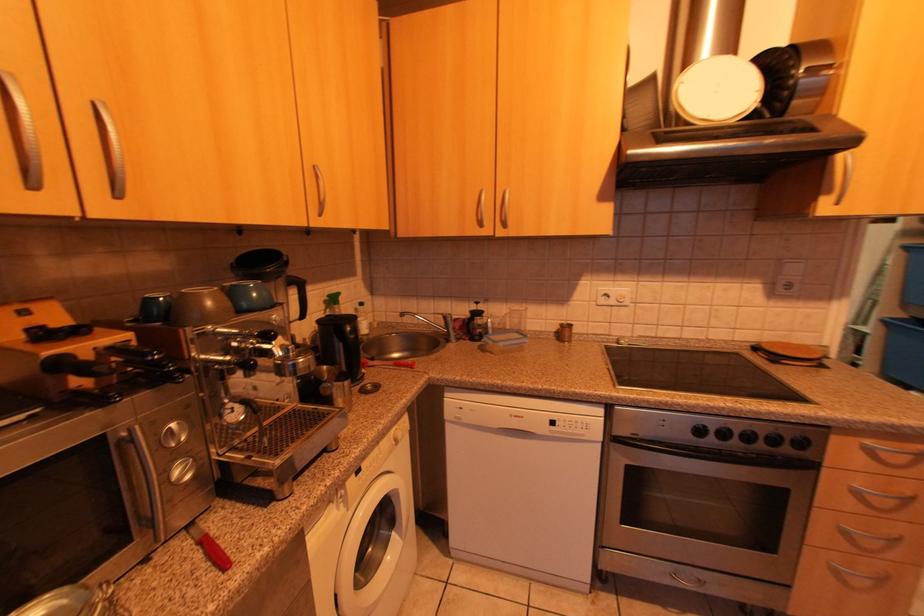
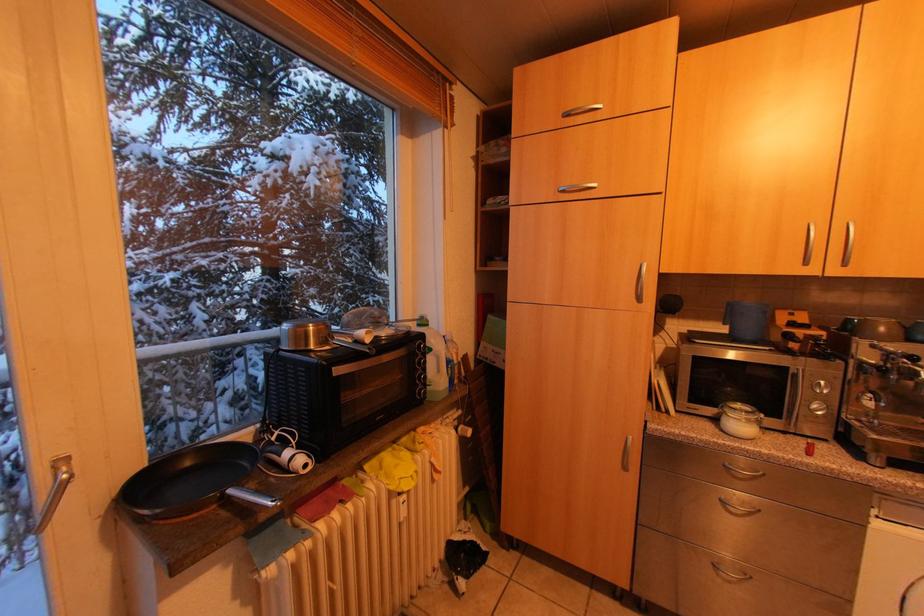
Question: The camera is either moving clockwise (left) or counter-clockwise (right) around the object. The first image is from the beginning of the video and the second image is from the end. Is the camera moving left or right when shooting the video?

Choices:
 (A) Left
 (B) Right

Answer: (B)